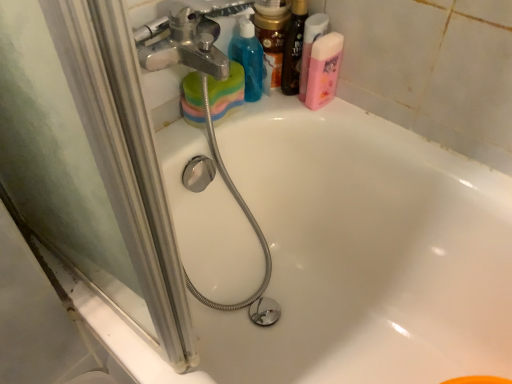
Question: Is pink matte bottle at upper right, arranged as the 1th cleaning product when viewed from the right, at the right side of shiny gold jar at upper center, which ranks as the first toiletry in left-to-right order?

Choices:
 (A) yes
 (B) no

Answer: (A)

Question: From a real-world perspective, is pink matte bottle at upper right, arranged as the 1th cleaning product when viewed from the right, on shiny gold jar at upper center, acting as the 2th toiletry starting from the right?

Choices:
 (A) no
 (B) yes

Answer: (A)

Question: Considering the relative sizes of pink matte bottle at upper right, arranged as the 1th cleaning product when viewed from the right, and shiny gold jar at upper center, which ranks as the first toiletry in left-to-right order, in the image provided, is pink matte bottle at upper right, arranged as the 1th cleaning product when viewed from the right, taller than shiny gold jar at upper center, which ranks as the first toiletry in left-to-right order,?

Choices:
 (A) no
 (B) yes

Answer: (A)

Question: Does pink matte bottle at upper right, arranged as the 1th cleaning product when viewed from the right, have a lesser width compared to shiny gold jar at upper center, which ranks as the first toiletry in left-to-right order?

Choices:
 (A) no
 (B) yes

Answer: (A)

Question: Is pink matte bottle at upper right, which appears as the second cleaning product when viewed from the left, facing away from shiny gold jar at upper center, which ranks as the first toiletry in left-to-right order?

Choices:
 (A) no
 (B) yes

Answer: (A)

Question: In terms of width, does pink matte shaving cream at upper right look wider or thinner when compared to shiny black bottle at upper right, which is the second toiletry in left-to-right order?

Choices:
 (A) wide
 (B) thin

Answer: (A)

Question: Based on their sizes in the image, would you say pink matte shaving cream at upper right is bigger or smaller than shiny black bottle at upper right, which is the second toiletry in left-to-right order?

Choices:
 (A) big
 (B) small

Answer: (B)

Question: In terms of height, does pink matte shaving cream at upper right look taller or shorter compared to shiny black bottle at upper right, the 1th toiletry in the right-to-left sequence?

Choices:
 (A) short
 (B) tall

Answer: (A)

Question: From the image's perspective, is pink matte shaving cream at upper right located above or below shiny black bottle at upper right, the 1th toiletry in the right-to-left sequence?

Choices:
 (A) below
 (B) above

Answer: (A)

Question: From their relative heights in the image, would you say shiny black bottle at upper right, which is the second toiletry in left-to-right order, is taller or shorter than white glossy bathtub at upper center?

Choices:
 (A) short
 (B) tall

Answer: (A)

Question: Looking at their shapes, would you say shiny black bottle at upper right, the 1th toiletry in the right-to-left sequence, is wider or thinner than white glossy bathtub at upper center?

Choices:
 (A) thin
 (B) wide

Answer: (A)

Question: Considering the positions of point (294, 92) and point (418, 175), is point (294, 92) closer or farther from the camera than point (418, 175)?

Choices:
 (A) farther
 (B) closer

Answer: (A)

Question: Would you say shiny black bottle at upper right, the 1th toiletry in the right-to-left sequence, is inside or outside white glossy bathtub at upper center?

Choices:
 (A) outside
 (B) inside

Answer: (A)

Question: Relative to shiny black bottle at upper right, which is the second toiletry in left-to-right order, is shiny gold jar at upper center, which ranks as the first toiletry in left-to-right order, in front or behind?

Choices:
 (A) front
 (B) behind

Answer: (B)

Question: Is shiny gold jar at upper center, which ranks as the first toiletry in left-to-right order, taller or shorter than shiny black bottle at upper right, the 1th toiletry in the right-to-left sequence?

Choices:
 (A) short
 (B) tall

Answer: (A)